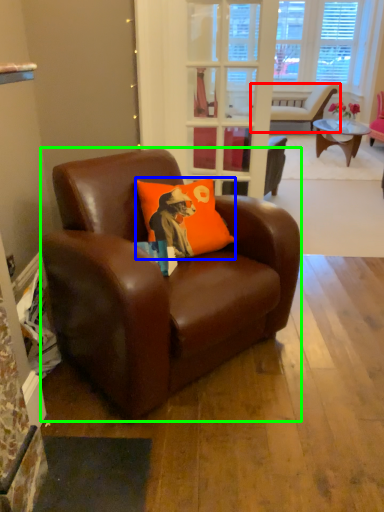
Question: Based on their relative distances, which object is nearer to chair (highlighted by a red box)? Choose from pillow (highlighted by a blue box) and chair (highlighted by a green box).

Choices:
 (A) pillow
 (B) chair

Answer: (A)